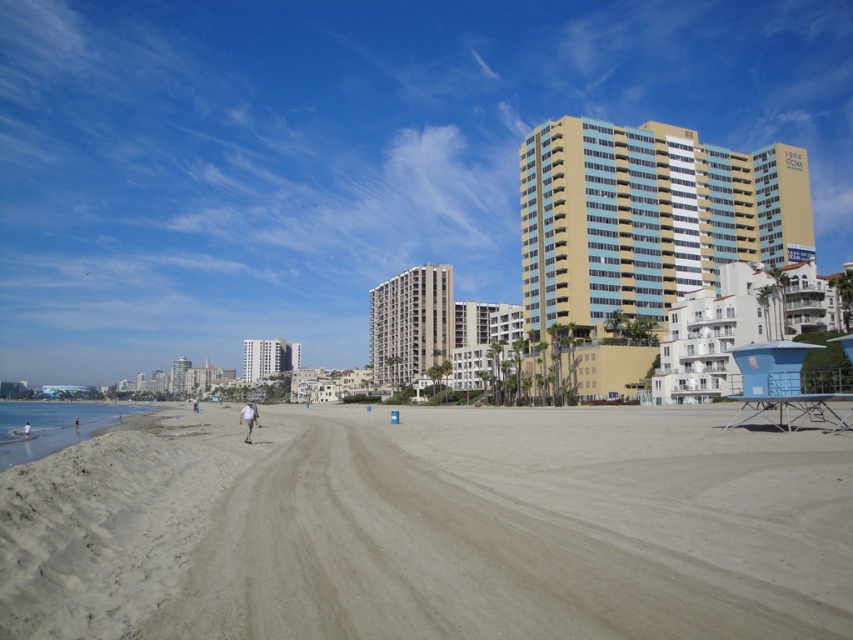
Is white stucco building at lower right shorter than beige concrete building at center?

Yes.

From the picture: Is white stucco building at lower right above beige concrete building at center?

Yes, white stucco building at lower right is above beige concrete building at center.

This screenshot has height=640, width=853. What do you see at coordinates (735, 326) in the screenshot?
I see `white stucco building at lower right` at bounding box center [735, 326].

Where is `white stucco building at lower right`? white stucco building at lower right is located at coordinates (735, 326).

Who is higher up, beige concrete building at center or smooth sand beach at lower left?

beige concrete building at center is higher up.

Is beige concrete building at center positioned before smooth sand beach at lower left?

No.

Does point (401, 285) come farther from viewer compared to point (97, 410)?

Yes, point (401, 285) is farther from viewer.

You are a GUI agent. You are given a task and a screenshot of the screen. Output one action in this format:
    pyautogui.click(x=<x>, y=<y>)
    Task: Click on the beige concrete building at center
    The height and width of the screenshot is (640, 853).
    Given the screenshot: What is the action you would take?
    pyautogui.click(x=410, y=323)

Who is positioned more to the left, white stucco building at lower right or white glossy building at center?

Positioned to the left is white glossy building at center.

Who is more distant from viewer, (x=698, y=339) or (x=271, y=358)?

The point (x=271, y=358) is behind.

Is point (741, 273) closer to viewer compared to point (248, 360)?

Yes, it is.

Find the location of a particular element. Image resolution: width=853 pixels, height=640 pixels. white stucco building at lower right is located at coordinates (735, 326).